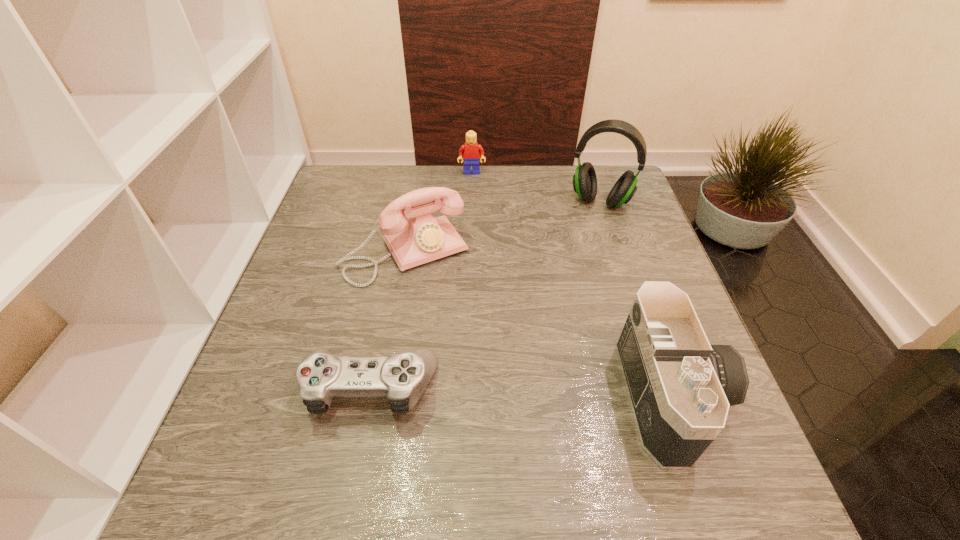
Image resolution: width=960 pixels, height=540 pixels. Find the location of `camera that is at the near edge`. camera that is at the near edge is located at coordinates (680, 387).

You are a GUI agent. You are given a task and a screenshot of the screen. Output one action in this format:
    pyautogui.click(x=<x>, y=<y>)
    Task: Click on the control present at the left edge
    The image size is (960, 540).
    Given the screenshot: What is the action you would take?
    pyautogui.click(x=403, y=377)

Locate an element on the screen. telephone that is at the left edge is located at coordinates (422, 238).

Locate an element on the screen. The image size is (960, 540). camera that is at the right edge is located at coordinates (680, 387).

Identify the location of headset that is at the right edge. Image resolution: width=960 pixels, height=540 pixels. (584, 180).

Where is `object situated at the near left corner`? The width and height of the screenshot is (960, 540). object situated at the near left corner is located at coordinates (403, 377).

Where is `object present at the far right corner`? This screenshot has height=540, width=960. object present at the far right corner is located at coordinates (584, 180).

Identify the location of object present at the near right corner. (680, 387).

What are the coordinates of `vacant space at the far edge of the desktop` in the screenshot? It's located at (502, 205).

The height and width of the screenshot is (540, 960). In the image, there is a desktop. Find the location of `vacant area at the near edge`. vacant area at the near edge is located at coordinates (473, 424).